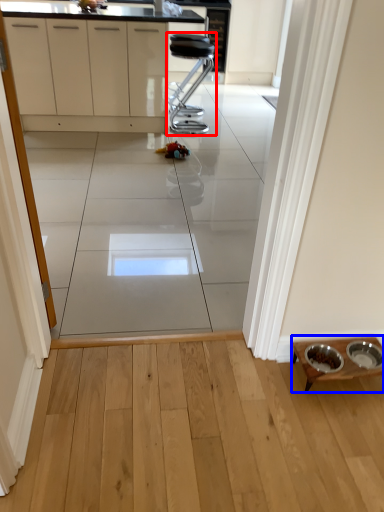
Question: Which point is further to the camera, furniture (highlighted by a red box) or table (highlighted by a blue box)?

Choices:
 (A) furniture
 (B) table

Answer: (A)